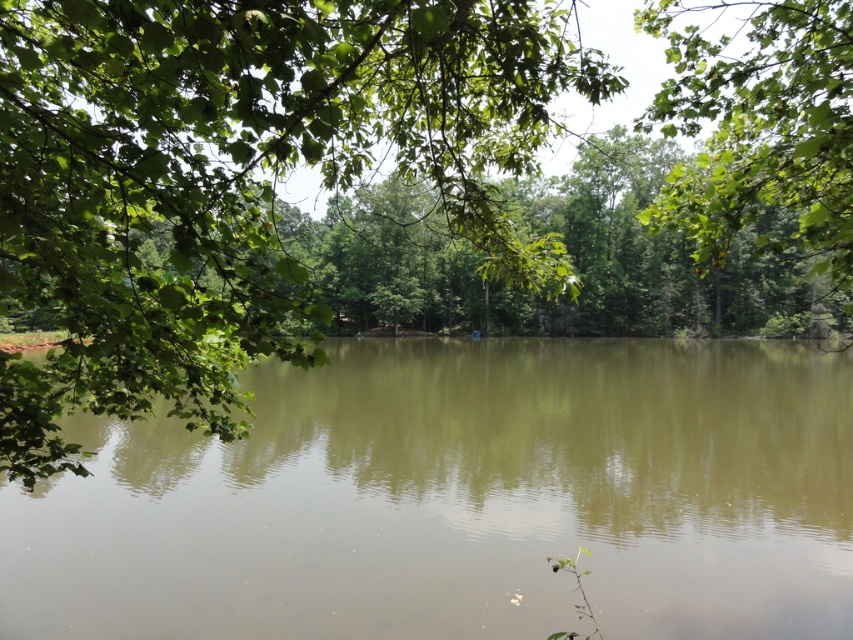
Question: Which point appears farthest from the camera in this image?

Choices:
 (A) (206, 368)
 (B) (660, 557)

Answer: (B)

Question: Can you confirm if greenish-brown water at center is smaller than green leafy tree at center?

Choices:
 (A) no
 (B) yes

Answer: (B)

Question: Which point is farther from the camera taking this photo?

Choices:
 (A) (387, 100)
 (B) (694, 70)

Answer: (A)

Question: Does green leafy tree at center have a greater width compared to green leafy tree at upper right?

Choices:
 (A) no
 (B) yes

Answer: (A)

Question: From the image, what is the correct spatial relationship of green leafy tree at center in relation to green leafy tree at upper right?

Choices:
 (A) above
 (B) below

Answer: (B)

Question: Estimate the real-world distances between objects in this image. Which object is farther from the green leafy tree at upper right?

Choices:
 (A) greenish-brown water at center
 (B) green leafy tree at center

Answer: (A)